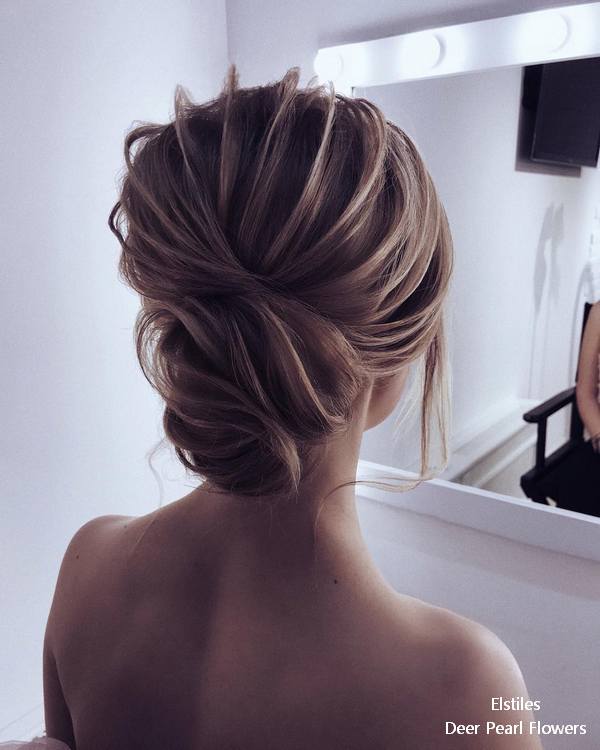
In order to click on tv on wall in this screenshot , I will do `click(557, 124)`.